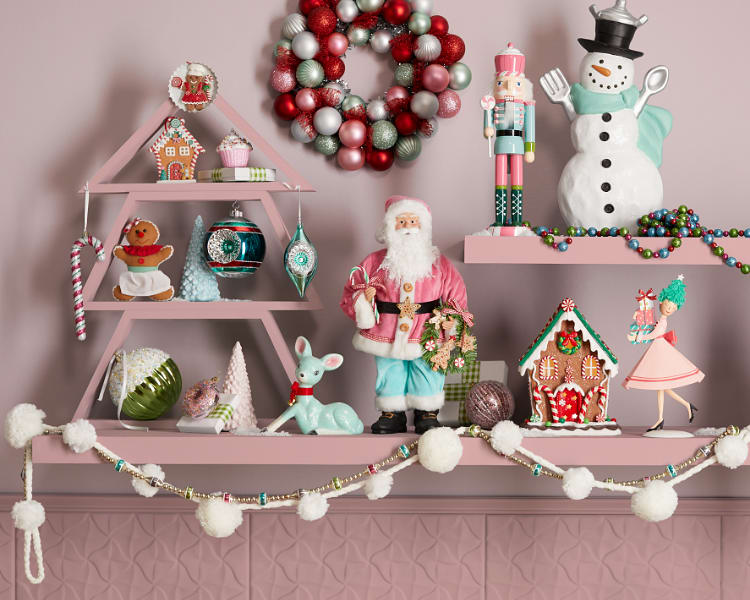
Locate an element on the screen. The image size is (750, 600). coat is located at coordinates 384,297.